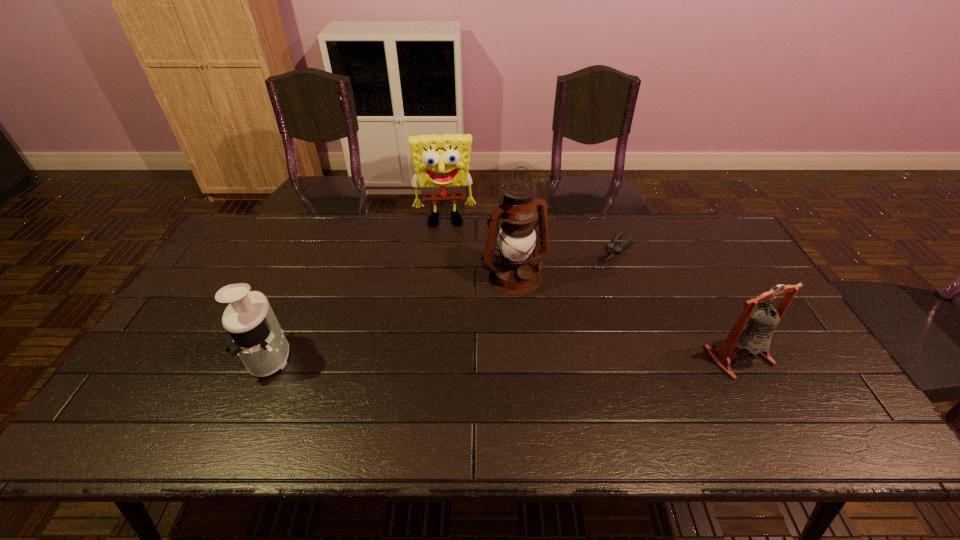
What are the coordinates of `juicer` in the screenshot? It's located at (258, 339).

You are a GUI agent. You are given a task and a screenshot of the screen. Output one action in this format:
    pyautogui.click(x=<x>, y=<y>)
    Task: Click on the rightmost object
    
    Given the screenshot: What is the action you would take?
    pyautogui.click(x=752, y=333)

Identify the location of the third object from right to left. (517, 238).

Locate an element on the screen. This screenshot has width=960, height=540. the tallest object is located at coordinates (517, 238).

What are the coordinates of `sponge` in the screenshot? It's located at (441, 162).

Where is `the fourth shortest object`? This screenshot has width=960, height=540. the fourth shortest object is located at coordinates [441, 162].

This screenshot has height=540, width=960. In order to click on pliers in this screenshot , I will do `click(618, 249)`.

The width and height of the screenshot is (960, 540). I want to click on the fourth object from left to right, so click(618, 249).

Locate an element on the screen. The image size is (960, 540). free space located on the back of the juicer is located at coordinates (305, 277).

Where is `blank space located 0.110m on the back of the bell`? The width and height of the screenshot is (960, 540). blank space located 0.110m on the back of the bell is located at coordinates (711, 305).